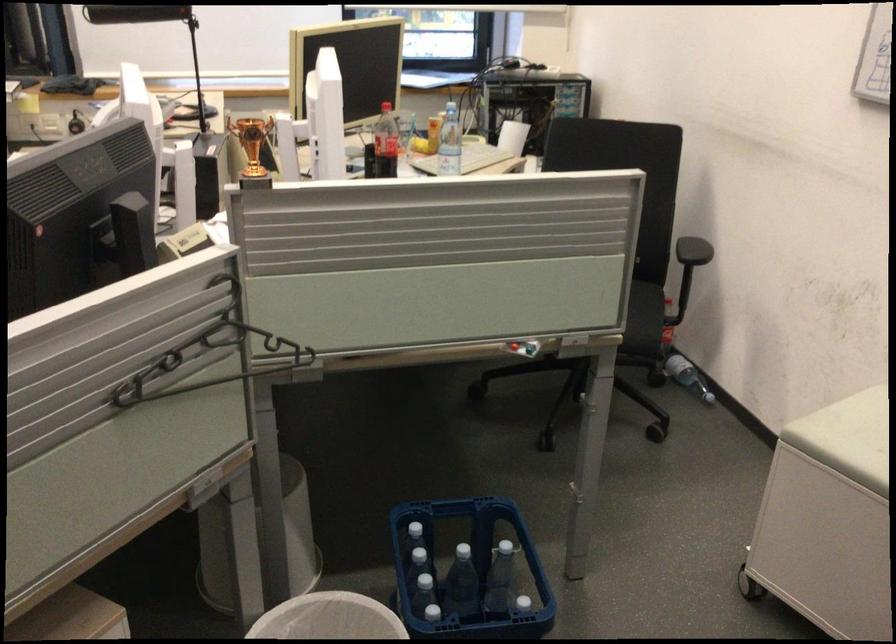
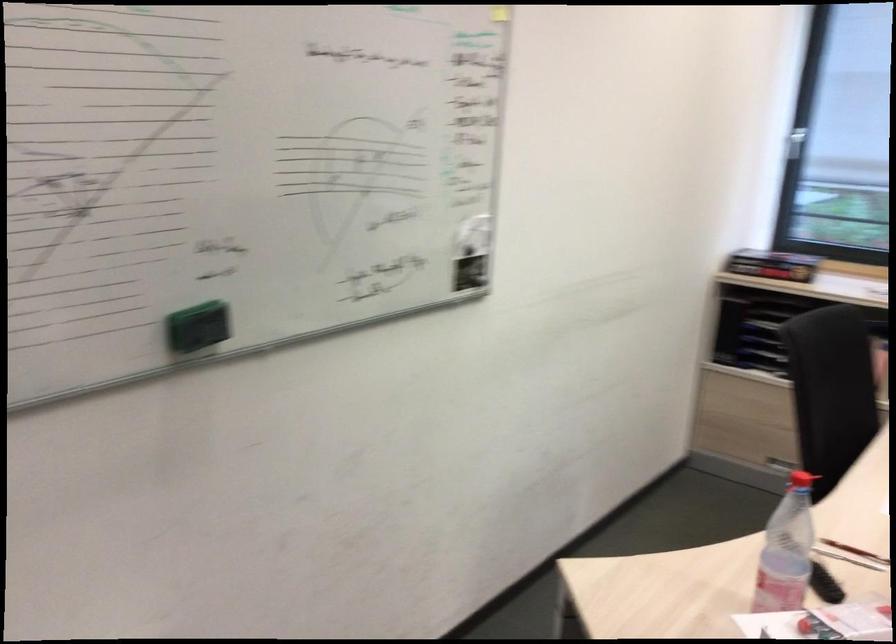
Question: The camera is either moving clockwise (left) or counter-clockwise (right) around the object. The first image is from the beginning of the video and the second image is from the end. Is the camera moving left or right when shooting the video?

Choices:
 (A) Left
 (B) Right

Answer: (B)